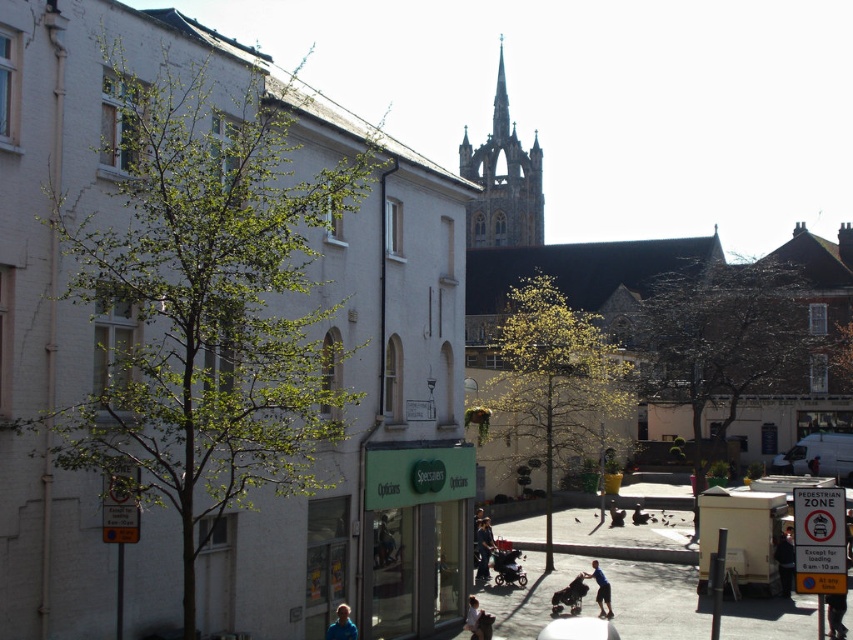
You are a photographer trying to capture a person wearing a light blue shirt at lower center and dark blue jeans at center. Based on their clothing positions, can you determine if the person is sitting or standing?

The light blue shirt at lower center is positioned under dark blue jeans at center, which suggests the person is standing since the shirt is below the jeans, a typical position when standing upright.